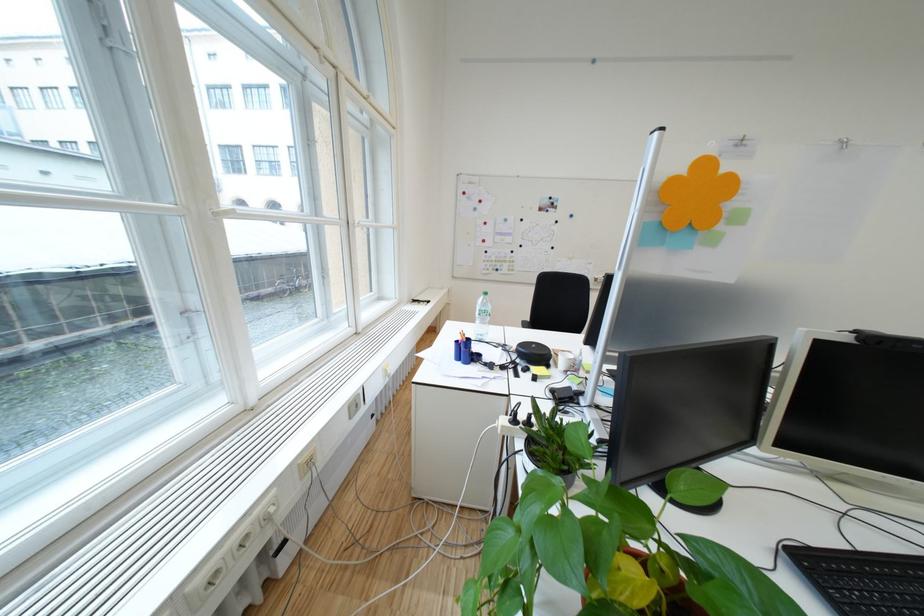
You are a GUI agent. You are given a task and a screenshot of the screen. Output one action in this format:
    pyautogui.click(x=<x>, y=<y>)
    Task: Click on the black zippered case
    
    Given the screenshot: What is the action you would take?
    pyautogui.click(x=862, y=580)